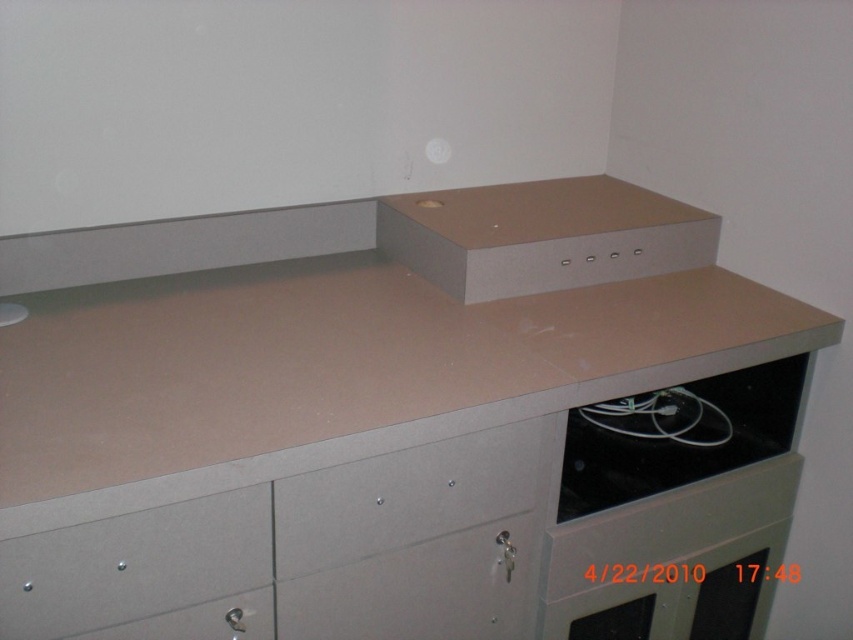
Which of these two, metallic gray drawer at lower left or black matte cable at lower right, stands shorter?

With less height is metallic gray drawer at lower left.

Based on the photo, how distant is metallic gray drawer at lower left from black matte cable at lower right?

They are 30.55 inches apart.

Is point (158, 522) farther from camera compared to point (781, 394)?

No, (158, 522) is closer to viewer.

Where is `metallic gray drawer at lower left`? This screenshot has height=640, width=853. metallic gray drawer at lower left is located at coordinates (128, 561).

Is beige matte counter top at center taller than metallic gray drawer at lower left?

Correct, beige matte counter top at center is much taller as metallic gray drawer at lower left.

What do you see at coordinates (331, 372) in the screenshot?
I see `beige matte counter top at center` at bounding box center [331, 372].

Where is `beige matte counter top at center`? This screenshot has width=853, height=640. beige matte counter top at center is located at coordinates pos(331,372).

Can you confirm if metallic gray drawer at lower center is taller than metallic gray drawer at lower left?

Indeed, metallic gray drawer at lower center has a greater height compared to metallic gray drawer at lower left.

Looking at this image, who is lower down, metallic gray drawer at lower center or metallic gray drawer at lower left?

metallic gray drawer at lower left is lower down.

Find the location of a particular element. The width and height of the screenshot is (853, 640). metallic gray drawer at lower center is located at coordinates (405, 497).

I want to click on metallic gray drawer at lower center, so (x=405, y=497).